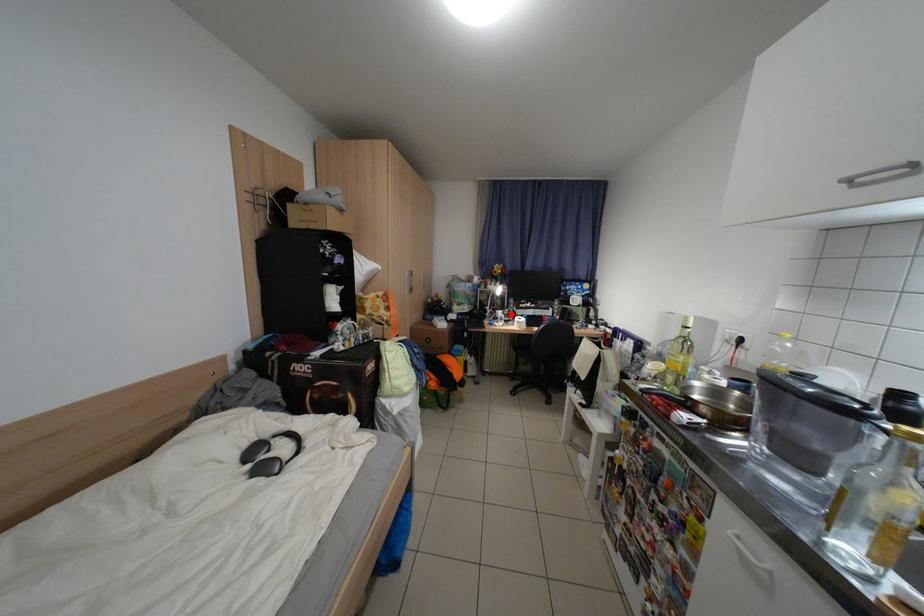
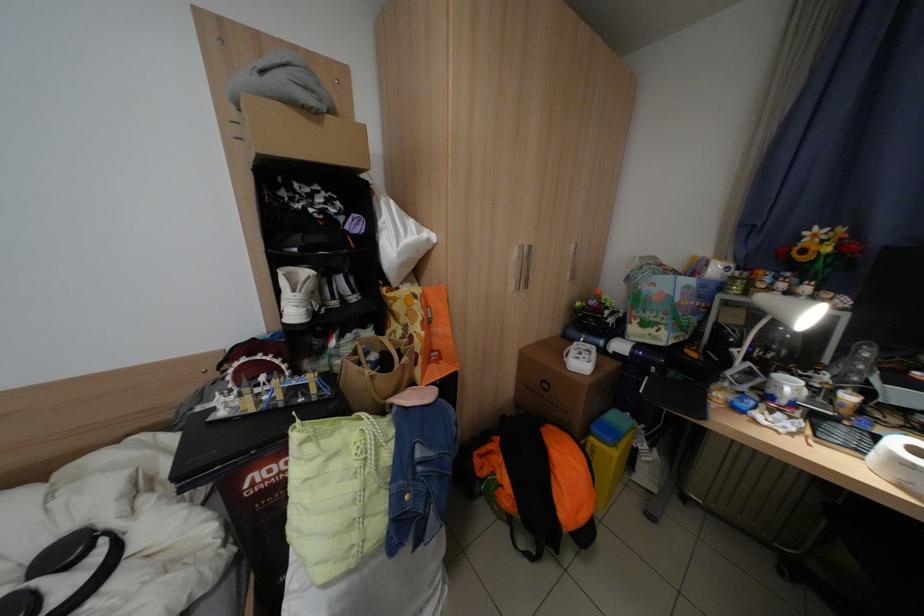
Locate, in the second image, the point that corresponds to the highlighted location in the first image.

(800, 387)